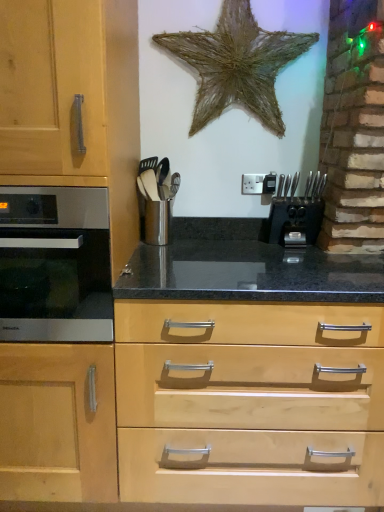
Question: From a real-world perspective, is metallic silver utensil holder at center positioned over satin silver oven at left based on gravity?

Choices:
 (A) no
 (B) yes

Answer: (B)

Question: From the image's perspective, would you say metallic silver utensil holder at center is positioned over satin silver oven at left?

Choices:
 (A) no
 (B) yes

Answer: (B)

Question: Is metallic silver utensil holder at center at the right side of satin silver oven at left?

Choices:
 (A) yes
 (B) no

Answer: (A)

Question: Is metallic silver utensil holder at center touching satin silver oven at left?

Choices:
 (A) yes
 (B) no

Answer: (B)

Question: Can we say metallic silver utensil holder at center lies outside satin silver oven at left?

Choices:
 (A) yes
 (B) no

Answer: (A)

Question: Which is correct: light wood drawer at center is inside black plastic knife block at center right, or outside of it?

Choices:
 (A) outside
 (B) inside

Answer: (A)

Question: Is light wood drawer at center in front of or behind black plastic knife block at center right in the image?

Choices:
 (A) front
 (B) behind

Answer: (A)

Question: From the image's perspective, is light wood drawer at center positioned above or below black plastic knife block at center right?

Choices:
 (A) above
 (B) below

Answer: (B)

Question: Is light wood drawer at center bigger or smaller than black plastic knife block at center right?

Choices:
 (A) small
 (B) big

Answer: (B)

Question: In terms of size, does black plastic knife block at center right appear bigger or smaller than light wood drawer at center?

Choices:
 (A) big
 (B) small

Answer: (B)

Question: From a real-world perspective, is black plastic knife block at center right above or below light wood drawer at center?

Choices:
 (A) above
 (B) below

Answer: (A)

Question: Would you say black plastic knife block at center right is to the left or to the right of light wood drawer at center in the picture?

Choices:
 (A) left
 (B) right

Answer: (B)

Question: Looking at their shapes, would you say black plastic knife block at center right is wider or thinner than light wood drawer at center?

Choices:
 (A) thin
 (B) wide

Answer: (A)

Question: From the image's perspective, is metallic silver utensil holder at center located above or below satin silver oven at left?

Choices:
 (A) below
 (B) above

Answer: (B)

Question: Relative to satin silver oven at left, is metallic silver utensil holder at center in front or behind?

Choices:
 (A) front
 (B) behind

Answer: (B)